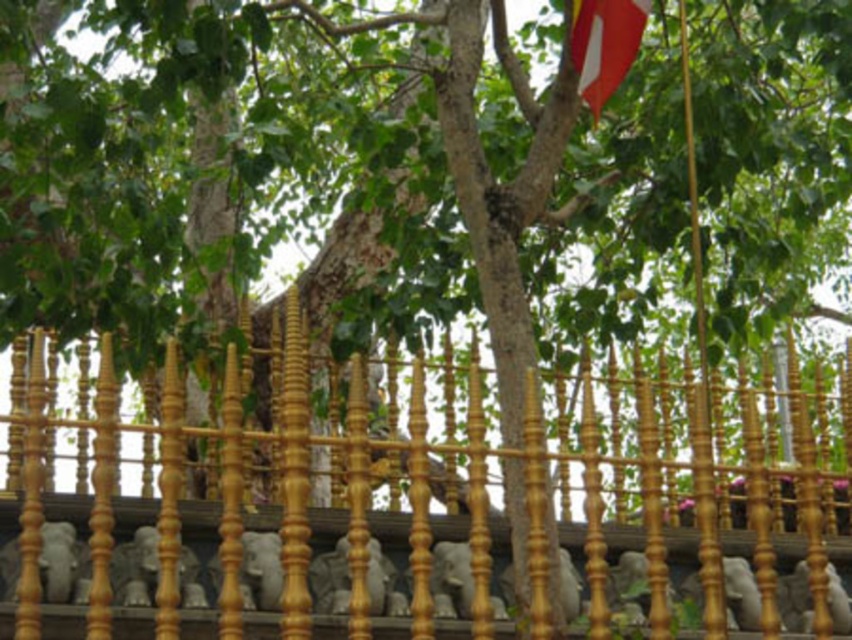
Is gold polished fence at center bigger than red fabric flag at upper right?

Yes, gold polished fence at center is bigger than red fabric flag at upper right.

Find the location of a particular element. The image size is (852, 640). gold polished fence at center is located at coordinates (415, 493).